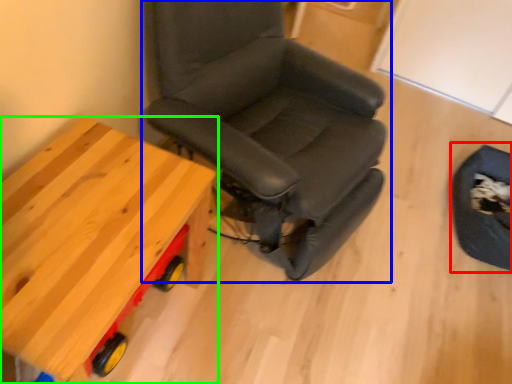
Question: Considering the real-world distances, which object is farthest from swivel chair (highlighted by a red box)? chair (highlighted by a blue box) or table (highlighted by a green box)?

Choices:
 (A) chair
 (B) table

Answer: (B)